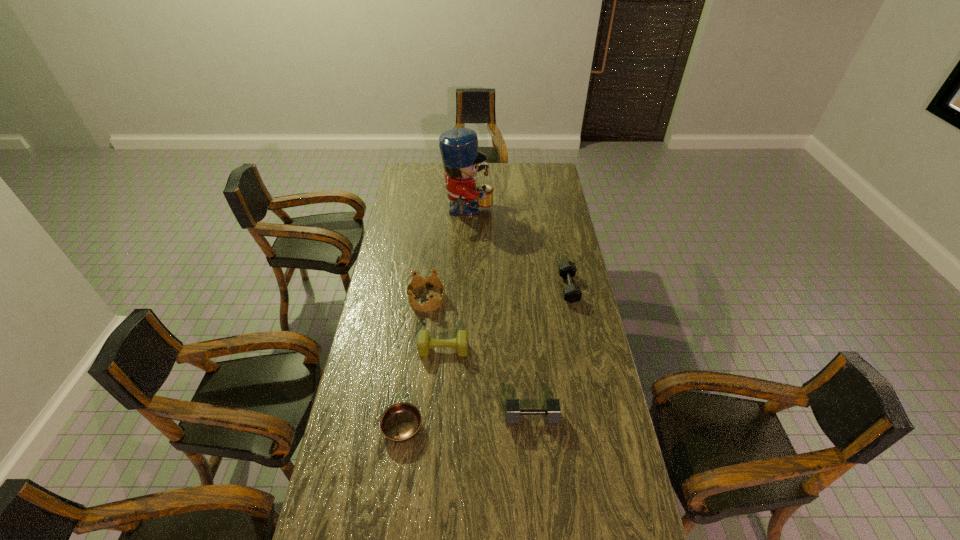
Image resolution: width=960 pixels, height=540 pixels. Identify the location of free region located 0.320m on the front-facing side of the nutcracker. 554,212.

Image resolution: width=960 pixels, height=540 pixels. Find the location of `vacant area situated 0.100m on the front-facing side of the tiara`. vacant area situated 0.100m on the front-facing side of the tiara is located at coordinates (468, 298).

Locate an element on the screen. Image resolution: width=960 pixels, height=540 pixels. vacant space located 0.180m on the back of the farthest dumbbell is located at coordinates (560, 247).

The image size is (960, 540). I want to click on free space located 0.170m on the right of the second dumbbell from right to left, so click(x=609, y=417).

Where is `free location located on the left of the fourth farthest object`? The height and width of the screenshot is (540, 960). free location located on the left of the fourth farthest object is located at coordinates (380, 349).

Identify the location of vacant space located on the back of the shortest object. This screenshot has height=540, width=960. (416, 329).

The image size is (960, 540). In order to click on tiara that is at the left edge in this screenshot , I will do `click(433, 303)`.

You are a GUI agent. You are given a task and a screenshot of the screen. Output one action in this format:
    pyautogui.click(x=<x>, y=<y>)
    Task: Click on the soup bowl that is positioned at the left edge
    Image resolution: width=960 pixels, height=540 pixels.
    Given the screenshot: What is the action you would take?
    pyautogui.click(x=400, y=422)

Locate an element on the screen. The image size is (960, 540). object located at the right edge is located at coordinates (572, 293).

Image resolution: width=960 pixels, height=540 pixels. In the image, there is a desktop. Find the location of `vacant space at the far edge`. vacant space at the far edge is located at coordinates (506, 169).